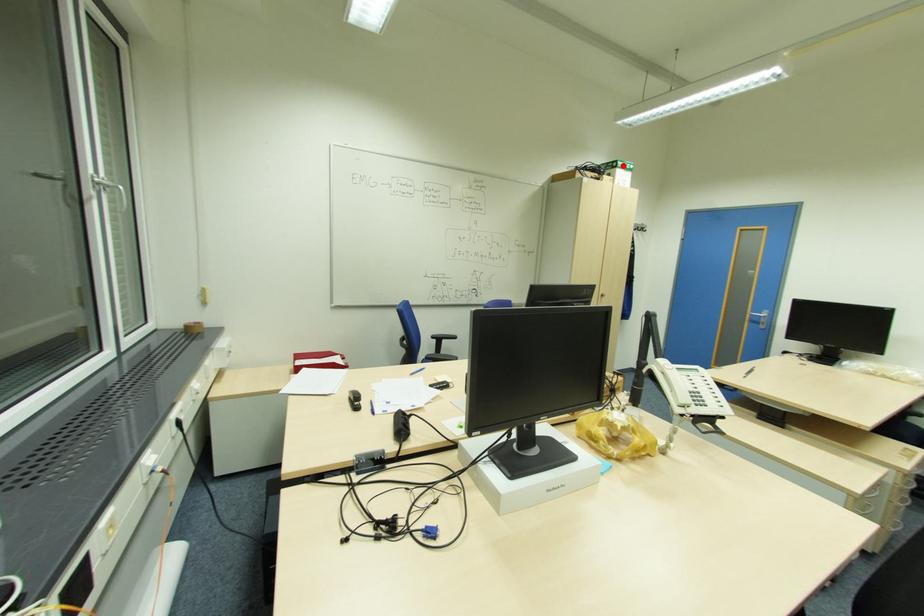
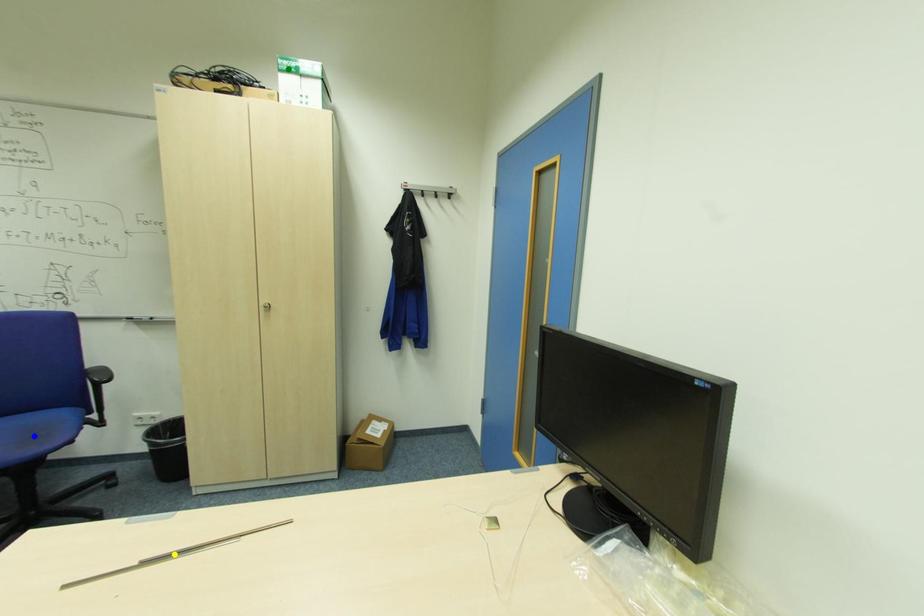
Question: I am providing you with two images of the same scene from different viewpoints. A red point is marked on the first image. You are given multiple points on the second image. Can you choose the point in image 2 that corresponds to the point in image 1?

Choices:
 (A) blue point
 (B) yellow point
 (C) green point

Answer: (C)